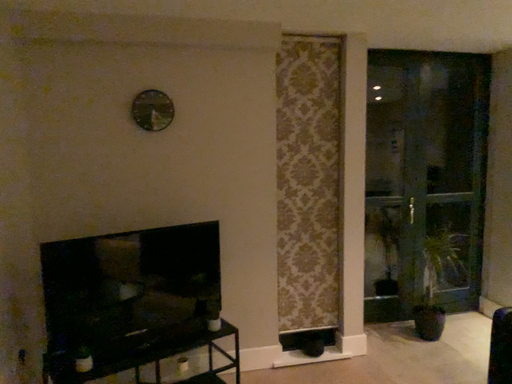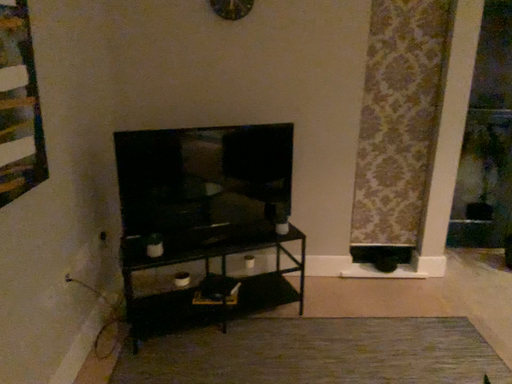
Question: Which way did the camera rotate in the video?

Choices:
 (A) rotated left
 (B) rotated right

Answer: (A)